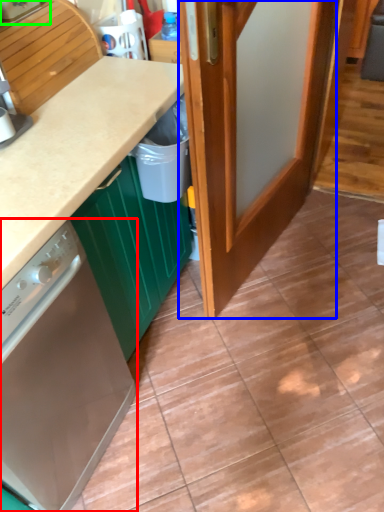
Question: Estimate the real-world distances between objects in this image. Which object is farther from home appliance (highlighted by a red box), door (highlighted by a blue box) or kitchen appliance (highlighted by a green box)?

Choices:
 (A) door
 (B) kitchen appliance

Answer: (B)